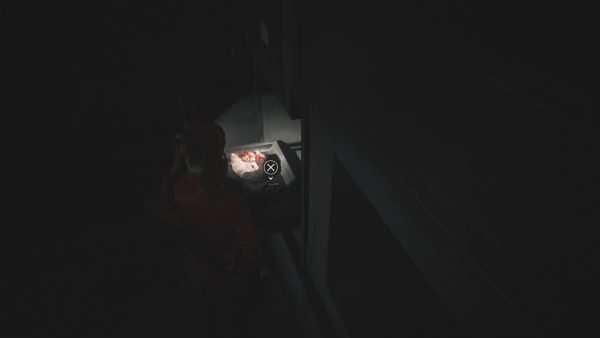
I want to click on light, so click(x=277, y=137).